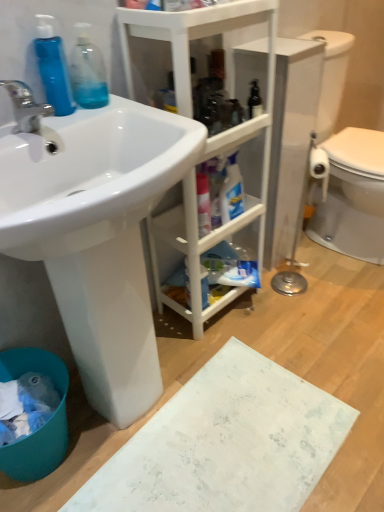
I want to click on free space to the back side of matte silver faucet at left, so click(x=65, y=116).